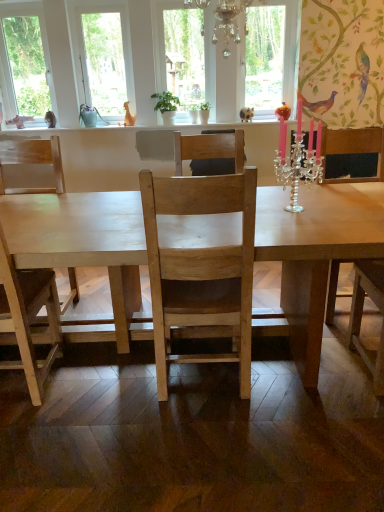
Question: From a real-world perspective, is silver/crystal candle holder at upper right located higher than natural wood chair at center, which is the second chair in left-to-right order?

Choices:
 (A) yes
 (B) no

Answer: (A)

Question: Considering the relative sizes of silver/crystal candle holder at upper right and natural wood chair at center, the 1th chair in the right-to-left sequence, in the image provided, is silver/crystal candle holder at upper right smaller than natural wood chair at center, the 1th chair in the right-to-left sequence,?

Choices:
 (A) no
 (B) yes

Answer: (B)

Question: Is silver/crystal candle holder at upper right closer to the viewer compared to natural wood chair at center, which is the second chair in left-to-right order?

Choices:
 (A) yes
 (B) no

Answer: (A)

Question: Could you tell me if silver/crystal candle holder at upper right is turned towards natural wood chair at center, which is the second chair in left-to-right order?

Choices:
 (A) yes
 (B) no

Answer: (B)

Question: Considering the relative sizes of silver/crystal candle holder at upper right and natural wood chair at center, which is the second chair in left-to-right order, in the image provided, is silver/crystal candle holder at upper right bigger than natural wood chair at center, which is the second chair in left-to-right order,?

Choices:
 (A) yes
 (B) no

Answer: (B)

Question: Looking at the image, does clear glass window at center, the 1th window frame viewed from the right, seem bigger or smaller compared to natural wood chair at center, which is the second chair in left-to-right order?

Choices:
 (A) small
 (B) big

Answer: (A)

Question: Considering the relative positions of clear glass window at center, the 1th window frame viewed from the right, and natural wood chair at center, which is the second chair in left-to-right order, in the image provided, is clear glass window at center, the 1th window frame viewed from the right, to the left or to the right of natural wood chair at center, which is the second chair in left-to-right order,?

Choices:
 (A) right
 (B) left

Answer: (B)

Question: Is clear glass window at center, the 1th window frame viewed from the right, taller or shorter than natural wood chair at center, the 1th chair in the right-to-left sequence?

Choices:
 (A) short
 (B) tall

Answer: (B)

Question: From a real-world perspective, is clear glass window at center, which ranks as the 2th window frame in left-to-right order, physically located above or below natural wood chair at center, which is the second chair in left-to-right order?

Choices:
 (A) above
 (B) below

Answer: (A)

Question: Based on their positions, is green matte plant at center located to the left or right of natural wood chair at center, the 1th chair in the right-to-left sequence?

Choices:
 (A) right
 (B) left

Answer: (B)

Question: Is point (163, 121) closer or farther from the camera than point (193, 151)?

Choices:
 (A) closer
 (B) farther

Answer: (B)

Question: Is green matte plant at center taller or shorter than natural wood chair at center, which is the second chair in left-to-right order?

Choices:
 (A) tall
 (B) short

Answer: (B)

Question: Looking at their shapes, would you say green matte plant at center is wider or thinner than natural wood chair at center, which is the second chair in left-to-right order?

Choices:
 (A) thin
 (B) wide

Answer: (A)

Question: From a real-world perspective, is natural wood chair at center, which is the second chair in left-to-right order, above or below silver/crystal candle holder at upper right?

Choices:
 (A) above
 (B) below

Answer: (B)

Question: From the image's perspective, relative to silver/crystal candle holder at upper right, is natural wood chair at center, the 1th chair in the right-to-left sequence, above or below?

Choices:
 (A) above
 (B) below

Answer: (A)